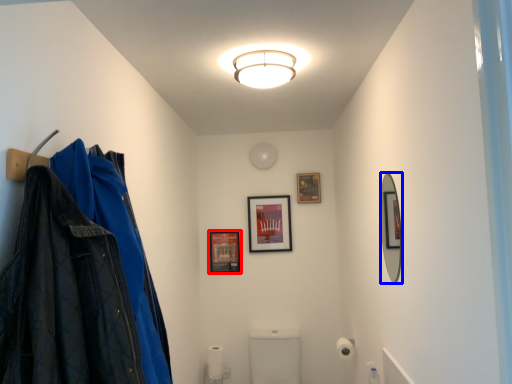
Question: Which object appears closest to the camera in this image, picture frame (highlighted by a red box) or mirror (highlighted by a blue box)?

Choices:
 (A) picture frame
 (B) mirror

Answer: (B)